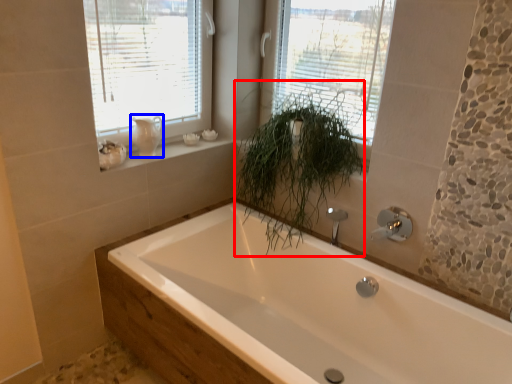
Question: Which object is closer to the camera taking this photo, plant (highlighted by a red box) or gray (highlighted by a blue box)?

Choices:
 (A) plant
 (B) gray

Answer: (A)